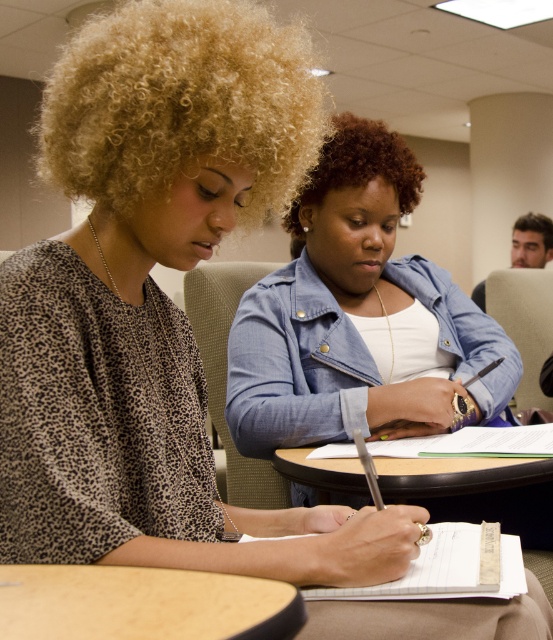
Looking at this image, what are the coordinates of the wooden table at lower left in the image?

The wooden table at lower left is located at coordinates point (143, 604).

You are a student who needs to place a textbook on the wooden table at lower left and the white lined paper at lower center. Which object should you place it on if you want it closer to the right side of the table?

You should place the textbook on the white lined paper at lower center because it is located to the right of the wooden table at lower left, making it closer to the right side of the table.

You are sitting at the table and want to hand a pen to the person wearing the leopard print blouse at center and the blue denim jacket at center. Which one can you reach first without moving your chair?

The leopard print blouse at center is closer to the viewer than the blue denim jacket at center, so you can reach the person wearing the leopard print blouse at center first without moving your chair.